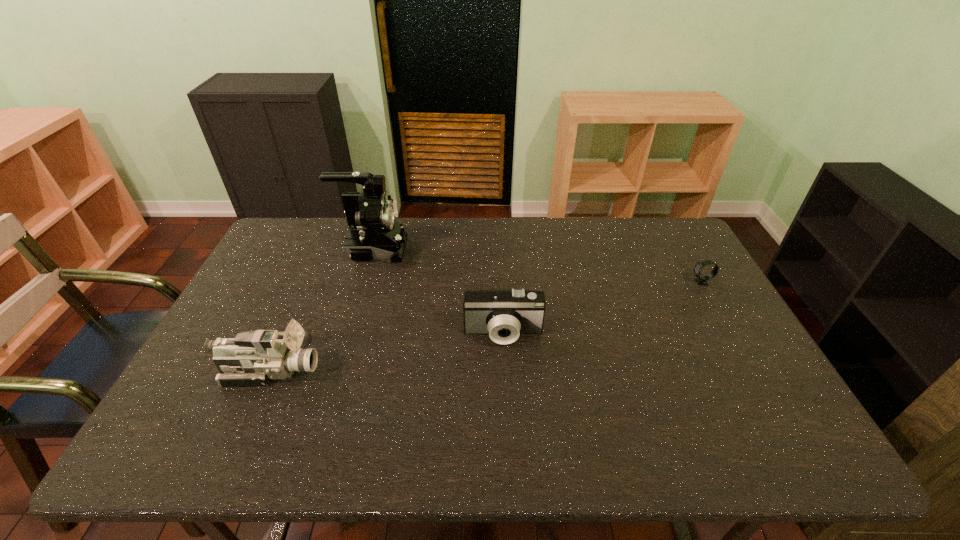
At what (x,y) coordinates should I click in order to perform the action: click on free spot located 0.310m on the lens of the second shortest object. Please return your answer as a coordinate pair (x, y). The width and height of the screenshot is (960, 540). Looking at the image, I should click on (510, 460).

The width and height of the screenshot is (960, 540). What are the coordinates of `vacant space located on the face of the third nearest object` in the screenshot? It's located at (595, 282).

This screenshot has height=540, width=960. What are the coordinates of `free space located 0.210m on the face of the third nearest object` in the screenshot? It's located at (624, 282).

The height and width of the screenshot is (540, 960). Find the location of `free region located on the face of the third nearest object`. free region located on the face of the third nearest object is located at coordinates (566, 282).

What are the coordinates of `object positioned at the far edge` in the screenshot? It's located at (374, 233).

Locate an element on the screen. This screenshot has height=540, width=960. object situated at the left edge is located at coordinates (253, 358).

I want to click on object that is at the right edge, so click(x=701, y=280).

In the image, there is a desktop. At what (x,y) coordinates should I click in order to perform the action: click on free space at the far edge. Please return your answer as a coordinate pair (x, y). This screenshot has height=540, width=960. Looking at the image, I should click on (408, 227).

In the image, there is a desktop. At what (x,y) coordinates should I click in order to perform the action: click on vacant space at the near edge. Please return your answer as a coordinate pair (x, y). The image size is (960, 540). Looking at the image, I should click on point(569,431).

Where is `free space at the left edge of the desktop`? The height and width of the screenshot is (540, 960). free space at the left edge of the desktop is located at coordinates (278, 286).